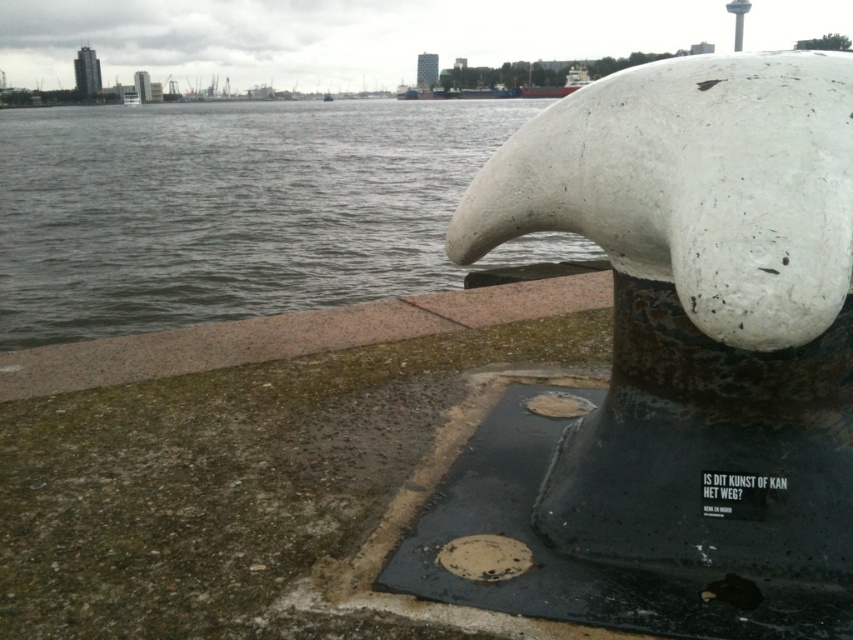
Consider the image. You are a maintenance worker who needs to inspect the white matte sculpture at center. Your inspection tool has a maximum reach of 1 meter. Without moving closer, can you inspect the sculpture from your current position?

The white matte sculpture at center and viewer are 98.64 centimeters apart from each other. Since the tool can reach up to 1 meter, you can inspect the sculpture from your current position.

You are an art conservator examining the white matte sculpture at center and the gray water at upper left. Based on their positions, which object is closer to you?

The white matte sculpture at center is closer to you because it is in front of the gray water at upper left.